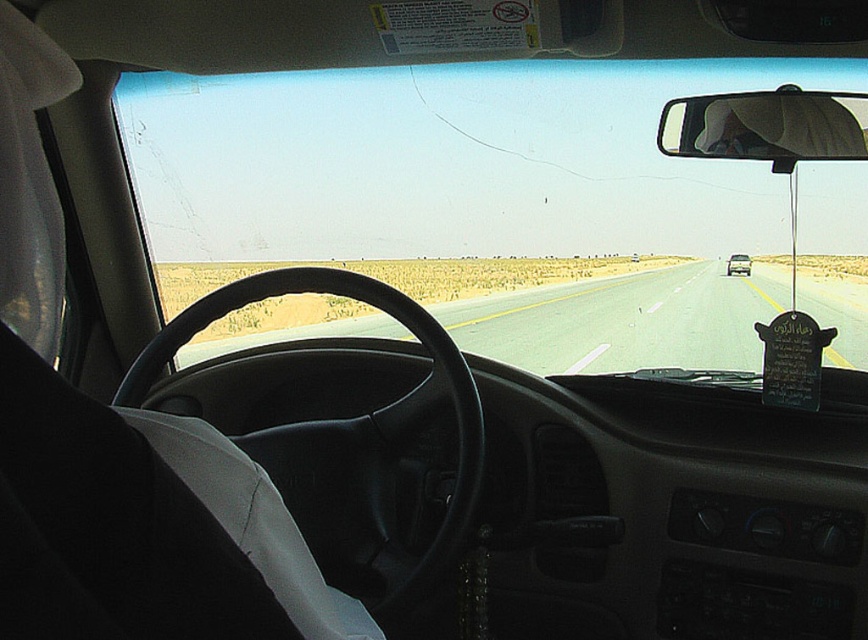
You are driving a car and want to check the road ahead and your rearview mirror. Which object, the smooth asphalt highway at center or the matte black rearview mirror at upper right, will appear larger in your view?

The smooth asphalt highway at center appears larger in your view because it is bigger than the matte black rearview mirror at upper right.

You are a passenger in the car and want to see the road ahead clearly. Which object, the smooth asphalt highway at center or the matte black rearview mirror at upper right, is positioned higher in your field of view?

The smooth asphalt highway at center is located above the matte black rearview mirror at upper right, so it is positioned higher in your field of view.